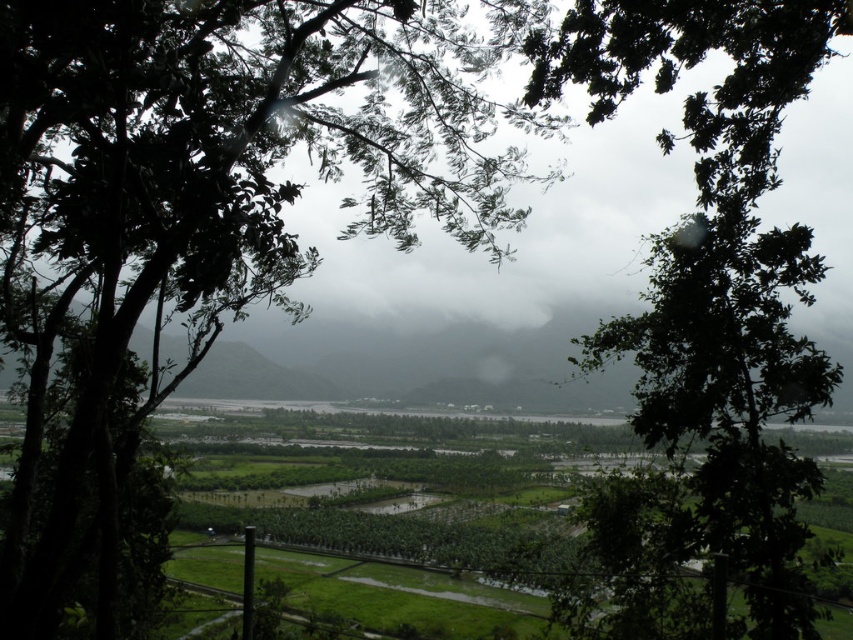
Is green leafy tree at center above green leafy tree at upper center?

Correct, green leafy tree at center is located above green leafy tree at upper center.

In order to click on green leafy tree at center in this screenshot , I will do `click(227, 173)`.

Image resolution: width=853 pixels, height=640 pixels. Find the location of `green leafy tree at center`. green leafy tree at center is located at coordinates (227, 173).